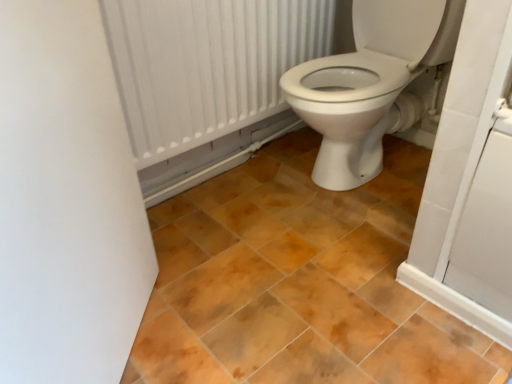
Question: Is brown matte tile at center completely or partially inside white textured radiator at upper center?

Choices:
 (A) yes
 (B) no

Answer: (B)

Question: Is white textured radiator at upper center positioned before brown matte tile at center?

Choices:
 (A) yes
 (B) no

Answer: (B)

Question: Is there a large distance between white textured radiator at upper center and brown matte tile at center?

Choices:
 (A) yes
 (B) no

Answer: (B)

Question: Is white textured radiator at upper center to the right of brown matte tile at center from the viewer's perspective?

Choices:
 (A) yes
 (B) no

Answer: (B)

Question: Considering the relative sizes of white textured radiator at upper center and brown matte tile at center in the image provided, is white textured radiator at upper center shorter than brown matte tile at center?

Choices:
 (A) yes
 (B) no

Answer: (B)

Question: Is white textured radiator at upper center taller than brown matte tile at center?

Choices:
 (A) no
 (B) yes

Answer: (B)

Question: Is brown matte tile at center next to white textured radiator at upper center?

Choices:
 (A) yes
 (B) no

Answer: (B)

Question: Is brown matte tile at center closer to camera compared to white textured radiator at upper center?

Choices:
 (A) yes
 (B) no

Answer: (A)

Question: Can you confirm if brown matte tile at center is wider than white textured radiator at upper center?

Choices:
 (A) yes
 (B) no

Answer: (A)

Question: Is white textured radiator at upper center inside brown matte tile at center?

Choices:
 (A) yes
 (B) no

Answer: (B)

Question: Considering the relative sizes of brown matte tile at center and white textured radiator at upper center in the image provided, is brown matte tile at center thinner than white textured radiator at upper center?

Choices:
 (A) yes
 (B) no

Answer: (B)

Question: From the image's perspective, is brown matte tile at center beneath white textured radiator at upper center?

Choices:
 (A) yes
 (B) no

Answer: (A)

Question: From a real-world perspective, is brown matte tile at center physically located above or below white textured radiator at upper center?

Choices:
 (A) below
 (B) above

Answer: (A)